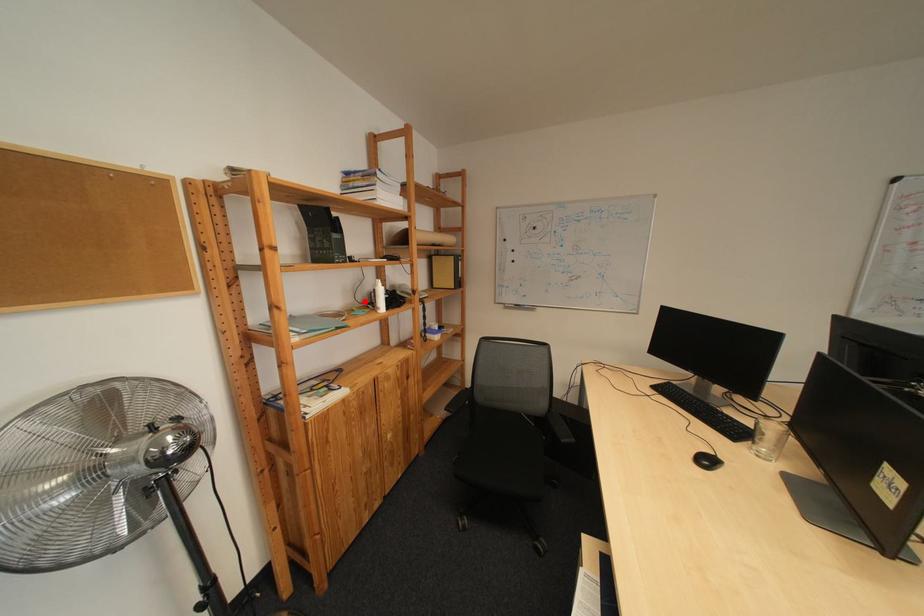
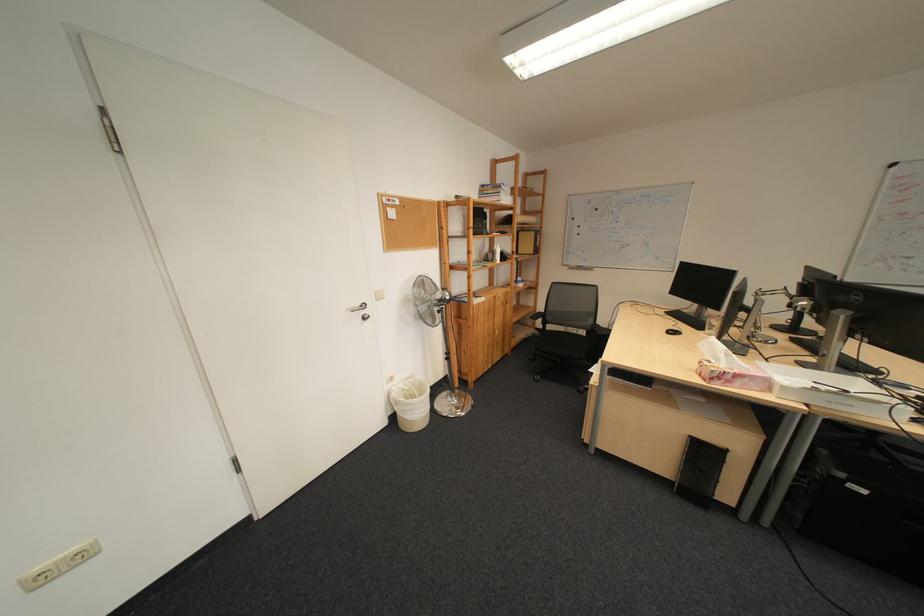
Find the pixel in the second image that matches the highlighted location in the first image.

(492, 257)